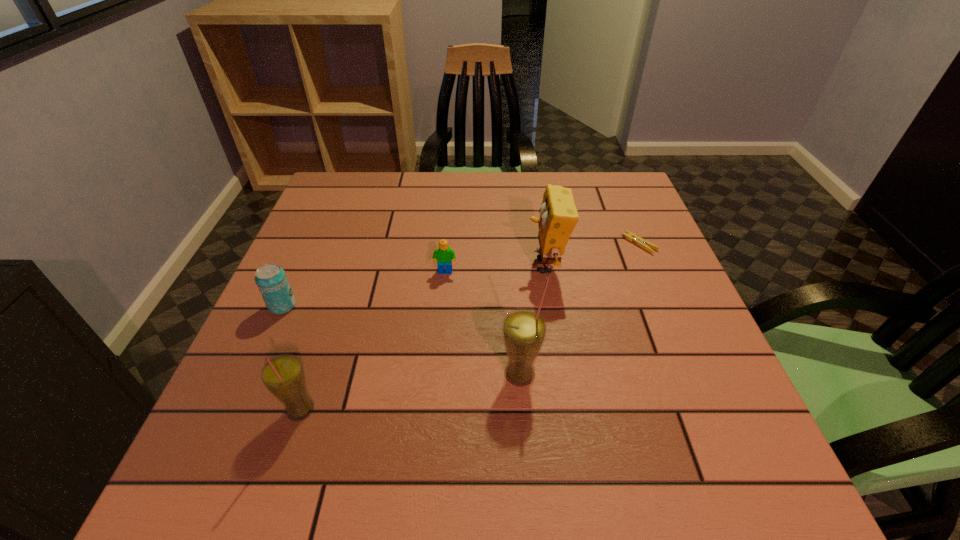
You are a GUI agent. You are given a task and a screenshot of the screen. Output one action in this format:
    pyautogui.click(x=<x>, y=<y>)
    Task: Click on the fifth object from right to left
    
    Given the screenshot: What is the action you would take?
    pyautogui.click(x=283, y=376)

Identify the location of the nearer straw for drinking. (283, 376).

What are the coordinates of `the right straw for drinking` in the screenshot? It's located at (524, 330).

At what (x,y) coordinates should I click in order to perform the action: click on the second nearest object. Please return your answer as a coordinate pair (x, y). Looking at the image, I should click on pyautogui.click(x=524, y=330).

The image size is (960, 540). I want to click on the third object from left to right, so click(x=444, y=255).

Where is `the leftmost object`? This screenshot has height=540, width=960. the leftmost object is located at coordinates (271, 280).

Where is `sponge`? This screenshot has width=960, height=540. sponge is located at coordinates (558, 215).

This screenshot has width=960, height=540. What are the coordinates of `the rightmost object` in the screenshot? It's located at (630, 236).

Where is `the shortest object`? Image resolution: width=960 pixels, height=540 pixels. the shortest object is located at coordinates (630, 236).

Image resolution: width=960 pixels, height=540 pixels. Identify the location of vacant space situated on the back of the shorter straw for drinking. (349, 260).